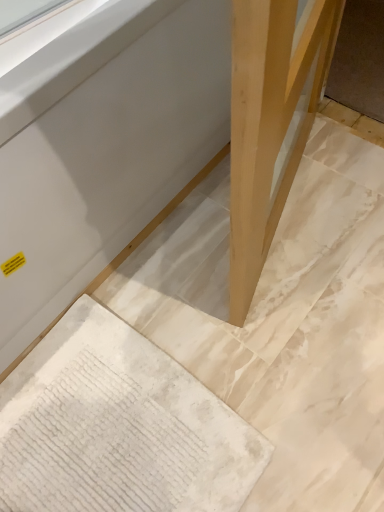
Identify the location of free space in front of natural wood leg at center. (306, 327).